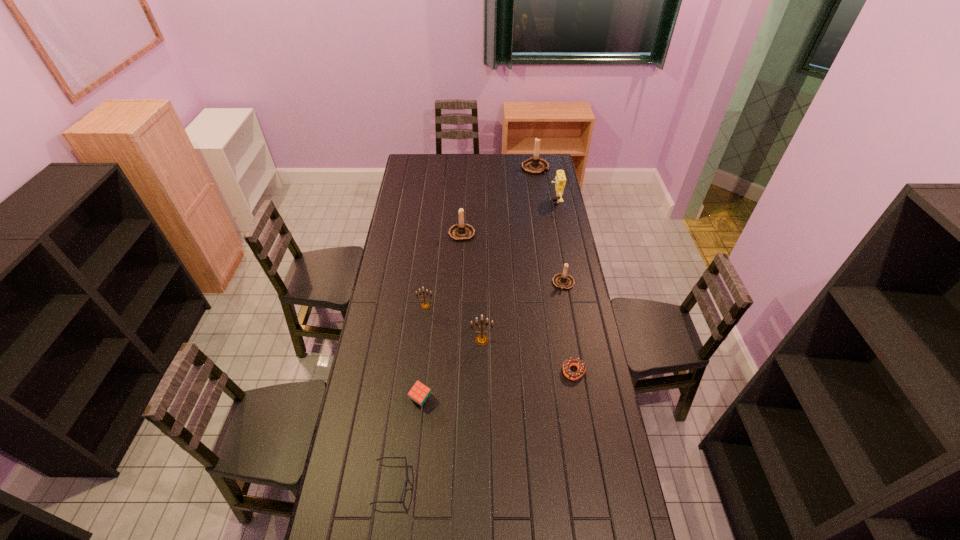
Identify the location of doughnut at the right edge. This screenshot has height=540, width=960. (572, 361).

Locate an element on the screen. The image size is (960, 540). object that is at the far right corner is located at coordinates (535, 166).

I want to click on vacant space at the left edge of the desktop, so click(384, 299).

The height and width of the screenshot is (540, 960). I want to click on vacant space at the right edge of the desktop, so click(x=575, y=385).

In the image, there is a desktop. At what (x,y) coordinates should I click in order to perform the action: click on free space at the far left corner. Please return your answer as a coordinate pair (x, y). This screenshot has height=540, width=960. Looking at the image, I should click on (430, 167).

The width and height of the screenshot is (960, 540). What are the coordinates of `vacant area that lies between the farthest brown candle holder and the third farthest object` in the screenshot? It's located at (498, 200).

Find the location of a particular element. This screenshot has width=960, height=540. vacant space that is in between the seventh tallest object and the doughnut is located at coordinates (497, 386).

At what (x,y) coordinates should I click in order to perform the action: click on vacant area that lies between the third nearest candelabrum and the sponge. Please return your answer as a coordinate pair (x, y). This screenshot has height=540, width=960. Looking at the image, I should click on (560, 243).

Find the location of a particular element. Image resolution: width=960 pixels, height=540 pixels. vacant space in between the nearest object and the nearer gold candelabrum is located at coordinates (437, 412).

The image size is (960, 540). Identify the location of vacant space in between the seventh farthest object and the bigger gold candelabrum. [x=528, y=356].